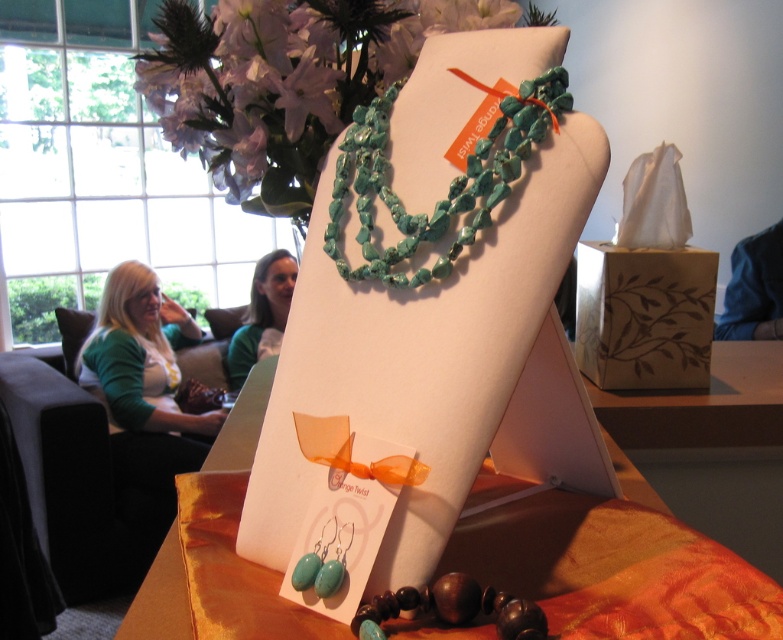
Does green jersey at left come behind green fabric at left?

No, green jersey at left is closer to the viewer.

Is green jersey at left in front of green fabric at left?

Yes, green jersey at left is closer to the viewer.

Find the location of `green jersey at left`. green jersey at left is located at coordinates (141, 355).

You are a GUI agent. You are given a task and a screenshot of the screen. Output one action in this format:
    pyautogui.click(x=<x>, y=<y>)
    Task: Click on the green jersey at left
    This screenshot has width=783, height=640.
    Given the screenshot: What is the action you would take?
    pyautogui.click(x=141, y=355)

Measure the distance between turquoise stone necklace at center and green fabric at left.

A distance of 9.20 feet exists between turquoise stone necklace at center and green fabric at left.

Who is shorter, turquoise stone necklace at center or green fabric at left?

Standing shorter between the two is turquoise stone necklace at center.

Is point (507, 154) positioned in front of point (240, 369)?

Yes.

Identify the location of turquoise stone necklace at center. (449, 184).

Is point (244, 157) less distant than point (121, 273)?

Yes, it is.

Is silky purple petals at upper center below green jersey at left?

No, silky purple petals at upper center is not below green jersey at left.

Find the location of a particular element. The image size is (783, 640). silky purple petals at upper center is located at coordinates (284, 81).